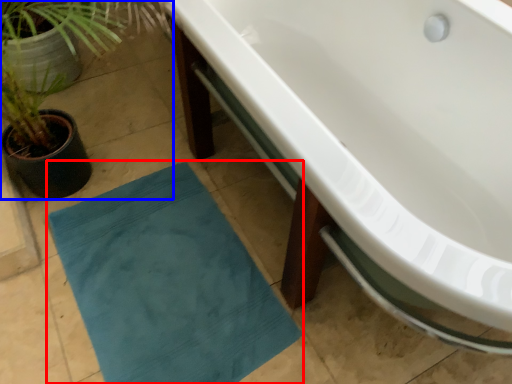
Question: Which object appears farthest to the camera in this image, bath mat (highlighted by a red box) or houseplant (highlighted by a blue box)?

Choices:
 (A) bath mat
 (B) houseplant

Answer: (A)